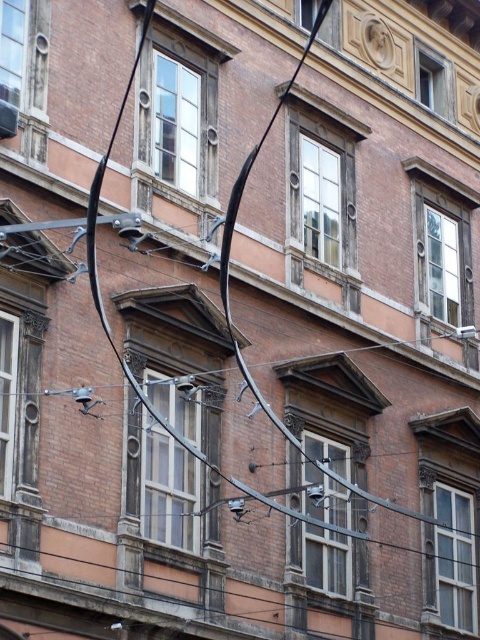
Can you confirm if wooden window at left is positioned to the right of clear glass window at upper left?

Indeed, wooden window at left is positioned on the right side of clear glass window at upper left.

Does wooden window at left appear over clear glass window at upper left?

Actually, wooden window at left is below clear glass window at upper left.

At what (x,y) coordinates should I click in order to perform the action: click on wooden window at left. Please return your answer as a coordinate pair (x, y). The image size is (480, 640). Looking at the image, I should click on (7, 396).

Identify the location of wooden window at left. (7, 396).

Who is positioned more to the left, wooden window frame at center or clear glass window at upper left?

From the viewer's perspective, clear glass window at upper left appears more on the left side.

Who is more forward, (370, 401) or (4, 35)?

Point (4, 35) is in front.

The image size is (480, 640). Identify the location of wooden window frame at center. (331, 410).

Does wooden window frame at center appear on the left side of wooden window at center?

Indeed, wooden window frame at center is positioned on the left side of wooden window at center.

Identify the location of wooden window frame at center. The image size is (480, 640). (331, 410).